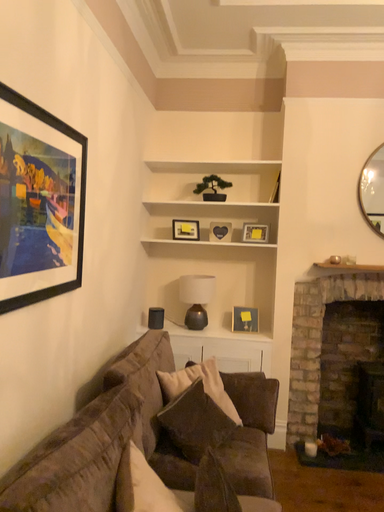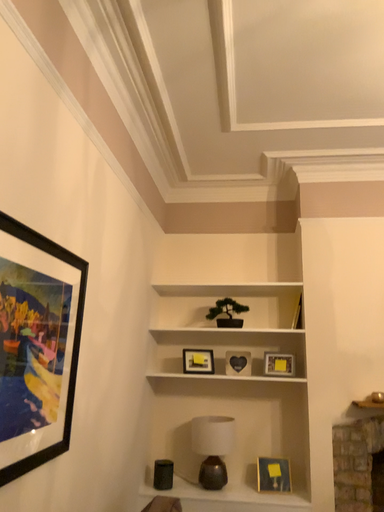
Question: How did the camera likely rotate when shooting the video?

Choices:
 (A) rotated upward
 (B) rotated downward

Answer: (A)